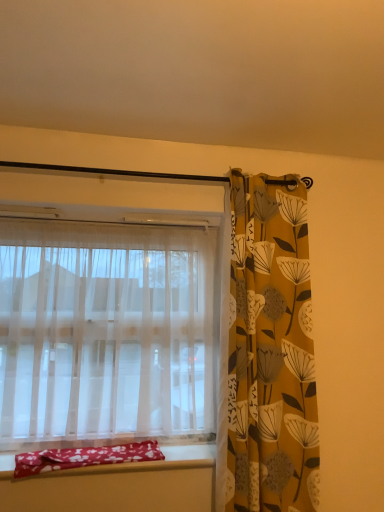
Question: Is yellow floral fabric curtain at right, the 2th curtain viewed from the left, outside sheer white curtain at left, which appears as the first curtain when viewed from the left?

Choices:
 (A) yes
 (B) no

Answer: (A)

Question: Can you confirm if yellow floral fabric curtain at right, the 2th curtain viewed from the left, is positioned to the right of sheer white curtain at left, which appears as the first curtain when viewed from the left?

Choices:
 (A) yes
 (B) no

Answer: (A)

Question: Considering the relative sizes of yellow floral fabric curtain at right, the 2th curtain viewed from the left, and sheer white curtain at left, arranged as the second curtain when viewed from the right, in the image provided, is yellow floral fabric curtain at right, the 2th curtain viewed from the left, shorter than sheer white curtain at left, arranged as the second curtain when viewed from the right,?

Choices:
 (A) yes
 (B) no

Answer: (B)

Question: Is sheer white curtain at left, arranged as the second curtain when viewed from the right, located within yellow floral fabric curtain at right, which is the first curtain in right-to-left order?

Choices:
 (A) yes
 (B) no

Answer: (B)

Question: Is yellow floral fabric curtain at right, which is the first curtain in right-to-left order, smaller than sheer white curtain at left, which appears as the first curtain when viewed from the left?

Choices:
 (A) no
 (B) yes

Answer: (B)

Question: Is the position of yellow floral fabric curtain at right, the 2th curtain viewed from the left, less distant than that of sheer white curtain at left, arranged as the second curtain when viewed from the right?

Choices:
 (A) yes
 (B) no

Answer: (A)

Question: Are red fabric pillow at lower left and sheer white curtain at left, arranged as the second curtain when viewed from the right, located far from each other?

Choices:
 (A) no
 (B) yes

Answer: (A)

Question: Is red fabric pillow at lower left thinner than sheer white curtain at left, which appears as the first curtain when viewed from the left?

Choices:
 (A) no
 (B) yes

Answer: (A)

Question: Is red fabric pillow at lower left oriented towards sheer white curtain at left, which appears as the first curtain when viewed from the left?

Choices:
 (A) yes
 (B) no

Answer: (B)

Question: Does red fabric pillow at lower left have a larger size compared to sheer white curtain at left, which appears as the first curtain when viewed from the left?

Choices:
 (A) yes
 (B) no

Answer: (B)

Question: From a real-world perspective, is red fabric pillow at lower left below sheer white curtain at left, which appears as the first curtain when viewed from the left?

Choices:
 (A) no
 (B) yes

Answer: (B)

Question: From the image's perspective, is red fabric pillow at lower left under sheer white curtain at left, arranged as the second curtain when viewed from the right?

Choices:
 (A) yes
 (B) no

Answer: (A)

Question: Considering the relative sizes of sheer white curtain at left, arranged as the second curtain when viewed from the right, and yellow floral fabric curtain at right, the 2th curtain viewed from the left, in the image provided, is sheer white curtain at left, arranged as the second curtain when viewed from the right, taller than yellow floral fabric curtain at right, the 2th curtain viewed from the left,?

Choices:
 (A) no
 (B) yes

Answer: (A)